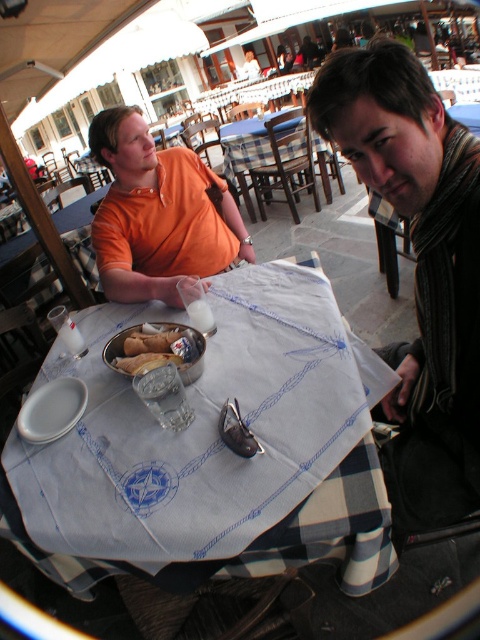
You are a server at the restaurant and need to place a 18 inch long plate between the white cloth at center and the orange cotton shirt at upper left. Will there be enough space?

The white cloth at center and orange cotton shirt at upper left are 19.00 inches apart from each other, so yes, the 18 inch long plate can fit between them with 1 inch of space remaining.

You are a customer sitting at the round table with a white tablecloth that has a nautical design. You want to place your phone on the white cloth at center. Where exactly should you place it?

The white cloth at center is located at point [216,451], so you should place your phone there.

You are a server at the outdoor dining area and need to place a new order of appetizers on the table. The appetizers come in a rectangular tray that requires 30 cm of space. The striped scarf at right and bread soft at center are currently on the table. Can you determine if there is enough space between them to place the tray?

The striped scarf at right has a larger size compared to bread soft at center. Since the striped scarf is bigger, there might be enough space between them to place the 30 cm tray. However, without knowing the exact distance between them, it is uncertain. The answer should be based on the given information which only states the size comparison, not the distance. Therefore, the information provided is insufficient to determine if the 30 cm tray can fit between them.